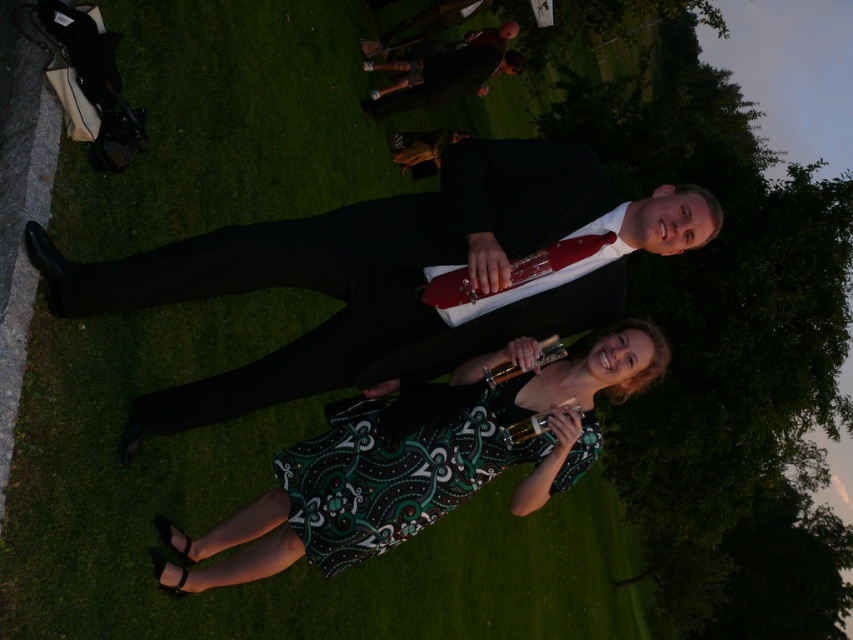
Question: Which is farther from the black satin suit at center?

Choices:
 (A) green paisley fabric dress at center
 (B) dark suit at upper center
 (C) printed fabric dress at center

Answer: (B)

Question: Which object appears closest to the camera in this image?

Choices:
 (A) printed fabric dress at center
 (B) green paisley fabric dress at center

Answer: (A)

Question: Does printed fabric dress at center appear under green paisley fabric dress at center?

Choices:
 (A) no
 (B) yes

Answer: (A)

Question: Can you confirm if printed fabric dress at center is positioned to the right of dark suit at upper center?

Choices:
 (A) yes
 (B) no

Answer: (A)

Question: Is black satin suit at center bigger than dark suit at upper center?

Choices:
 (A) yes
 (B) no

Answer: (B)

Question: Which point is closer to the camera?

Choices:
 (A) printed fabric dress at center
 (B) dark suit at upper center
 (C) black satin suit at center
 (D) green paisley fabric dress at center

Answer: (C)